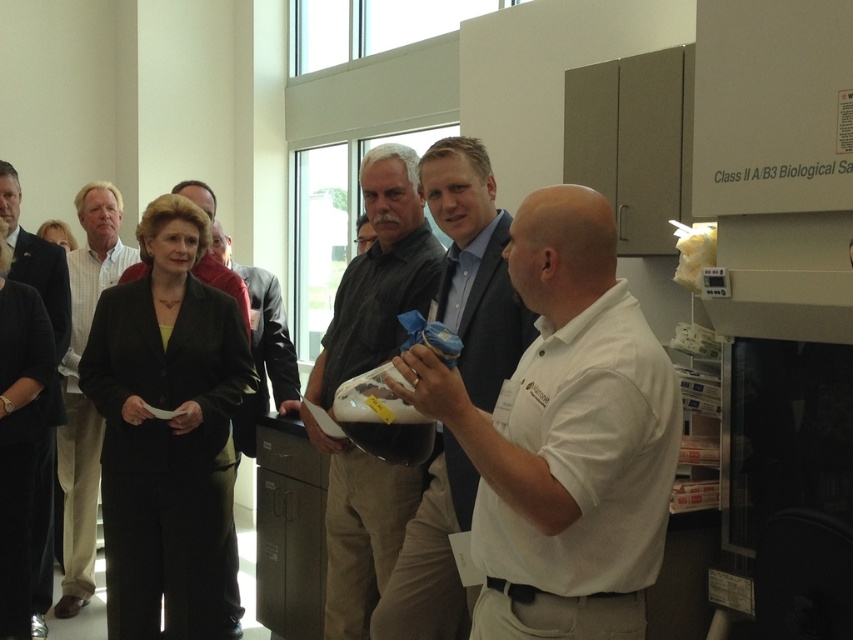
You are a visitor in the lab and need to find the person wearing the light brown shirt at center. Which direction should you look relative to the dark suit jacket at center?

The light brown shirt at center is much taller than the dark suit jacket at center, so you should look upwards from the dark suit jacket at center to find the light brown shirt at center.

You are attending a presentation in a lab and see the white matte shirt at center and the black fabric suit at center. Which one is lower in position?

Answer: The white matte shirt at center is positioned under the black fabric suit at center, so it is lower in position.

You are organizing a photo shoot and need to arrange the light brown shirt at center and the dark suit jacket at center in a way that highlights their size difference. Which object should be placed in front to emphasize the size contrast?

The light brown shirt at center is smaller than the dark suit jacket at center, so placing the smaller light brown shirt at center in front would make the dark suit jacket at center appear even larger in comparison.